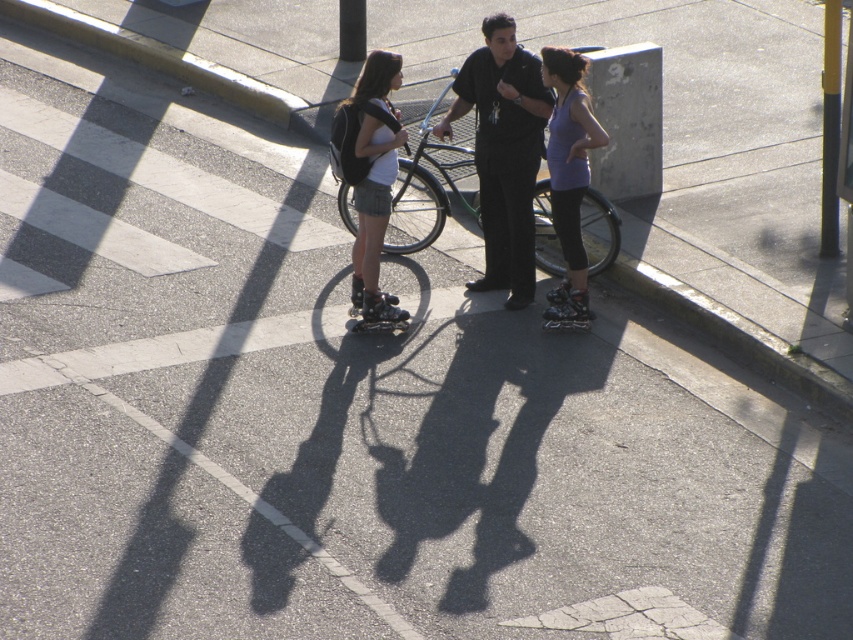
Is black smooth shirt at center below purple matte tank top at center?

Actually, black smooth shirt at center is above purple matte tank top at center.

Can you confirm if black smooth shirt at center is shorter than purple matte tank top at center?

No.

Between point (485, 156) and point (561, 141), which one is positioned behind?

Positioned behind is point (485, 156).

Locate an element on the screen. This screenshot has width=853, height=640. black smooth shirt at center is located at coordinates (503, 152).

Measure the distance from matte black roller skates at center to purple matte tank top at center.

39.18 inches

Which is behind, point (387, 90) or point (553, 49)?

The point (387, 90) is behind.

Who is more distant from viewer, (355,195) or (578,316)?

Positioned behind is point (578,316).

This screenshot has height=640, width=853. In order to click on matte black roller skates at center in this screenshot , I will do `click(370, 180)`.

Can you confirm if black smooth shirt at center is positioned above silver metallic bicycle at center?

Correct, black smooth shirt at center is located above silver metallic bicycle at center.

Can you confirm if black smooth shirt at center is smaller than silver metallic bicycle at center?

No.

This screenshot has width=853, height=640. In order to click on black smooth shirt at center in this screenshot , I will do `click(503, 152)`.

Locate an element on the screen. black smooth shirt at center is located at coordinates point(503,152).